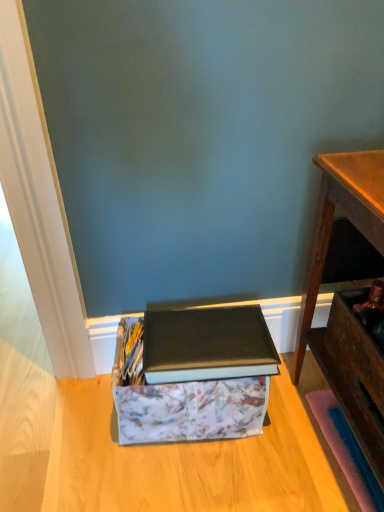
In order to click on free spot to the left of floral fabric storage box at lower center in this screenshot , I will do `click(69, 433)`.